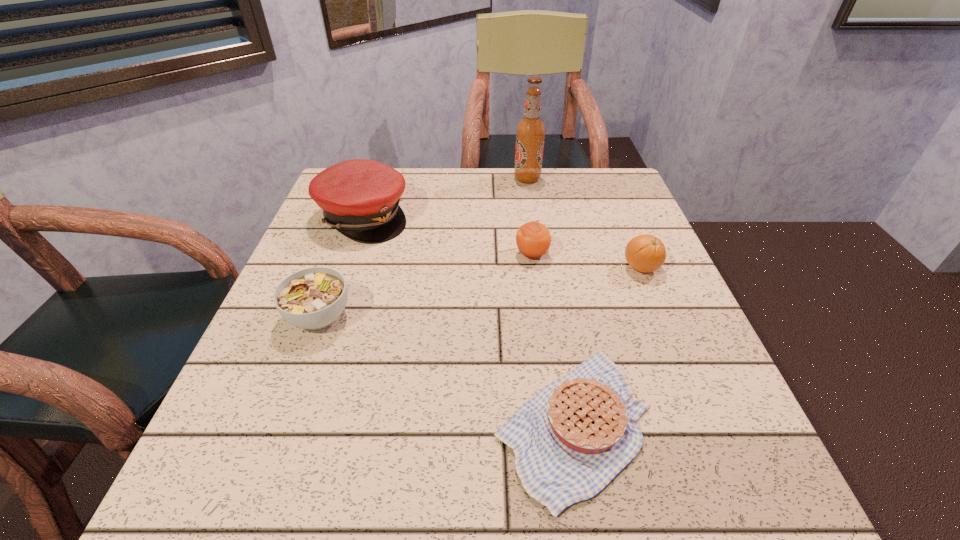
Locate an element on the screen. object that stands as the second closest to the left orange is located at coordinates (576, 434).

Identify the location of object identified as the fourth closest to the right orange. This screenshot has height=540, width=960. (360, 198).

The width and height of the screenshot is (960, 540). Identify the location of free spot that satisfies the following two spatial constraints: 1. on the back side of the right orange; 2. at the front of the cap where the visor is located. (620, 217).

The height and width of the screenshot is (540, 960). What are the coordinates of `free space that satisfies the following two spatial constraints: 1. at the front of the rightmost object where the visor is located; 2. on the right side of the second tallest object` in the screenshot? It's located at (346, 267).

Find the location of a particular element. free space in the image that satisfies the following two spatial constraints: 1. at the front of the second tallest object where the visor is located; 2. on the left side of the nearest object is located at coordinates (292, 424).

Where is `blank space that satisfies the following two spatial constraints: 1. at the front of the cap where the visor is located; 2. on the back side of the right orange`? The image size is (960, 540). blank space that satisfies the following two spatial constraints: 1. at the front of the cap where the visor is located; 2. on the back side of the right orange is located at coordinates (346, 267).

I want to click on vacant space that satisfies the following two spatial constraints: 1. on the front label of the tallest object; 2. on the left side of the nearest object, so click(565, 424).

At what (x,y) coordinates should I click in order to perform the action: click on vacant position in the image that satisfies the following two spatial constraints: 1. at the front of the cap where the visor is located; 2. on the left side of the left orange. Please return your answer as a coordinate pair (x, y). Looking at the image, I should click on (350, 254).

Identify the location of free space that satisfies the following two spatial constraints: 1. on the front label of the pie; 2. on the left side of the beer bottle. The width and height of the screenshot is (960, 540). 565,424.